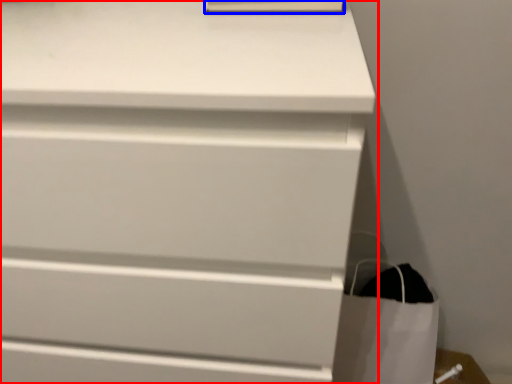
Question: Which point is further to the camera, chest of drawers (highlighted by a red box) or paperback book (highlighted by a blue box)?

Choices:
 (A) chest of drawers
 (B) paperback book

Answer: (B)